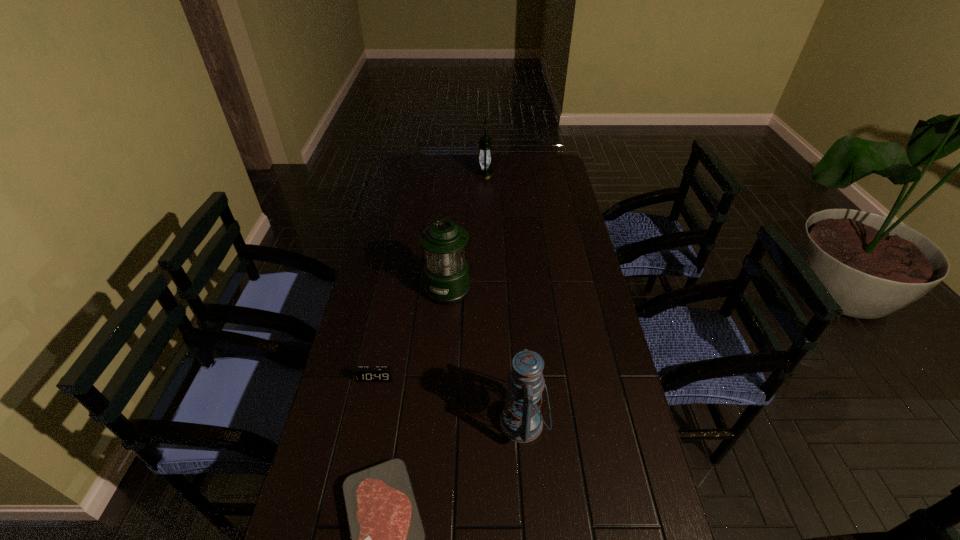
Find the location of a particular element. vacant point located on the front-facing side of the second nearest object is located at coordinates (350, 422).

The width and height of the screenshot is (960, 540). I want to click on vacant area located 0.180m on the front-facing side of the second nearest object, so click(429, 422).

Find the location of `free location located 0.120m on the front-facing side of the second nearest object`. free location located 0.120m on the front-facing side of the second nearest object is located at coordinates (452, 422).

The image size is (960, 540). In order to click on blank area located 0.160m on the front-facing side of the alarm clock in this screenshot , I will do `click(363, 437)`.

The width and height of the screenshot is (960, 540). What are the coordinates of `object that is at the far edge` in the screenshot? It's located at pos(484,171).

What are the coordinates of `object positioned at the left edge` in the screenshot? It's located at (362, 373).

In the image, there is a desktop. Identify the location of vacant area at the far edge. (503, 173).

In the image, there is a desktop. At what (x,y) coordinates should I click in order to perform the action: click on vacant space at the left edge. Please return your answer as a coordinate pair (x, y). This screenshot has height=540, width=960. Looking at the image, I should click on (307, 512).

In the image, there is a desktop. What are the coordinates of `vacant space at the right edge` in the screenshot? It's located at (556, 246).

Locate an element on the screen. This screenshot has height=540, width=960. free space at the far left corner of the desktop is located at coordinates (417, 177).